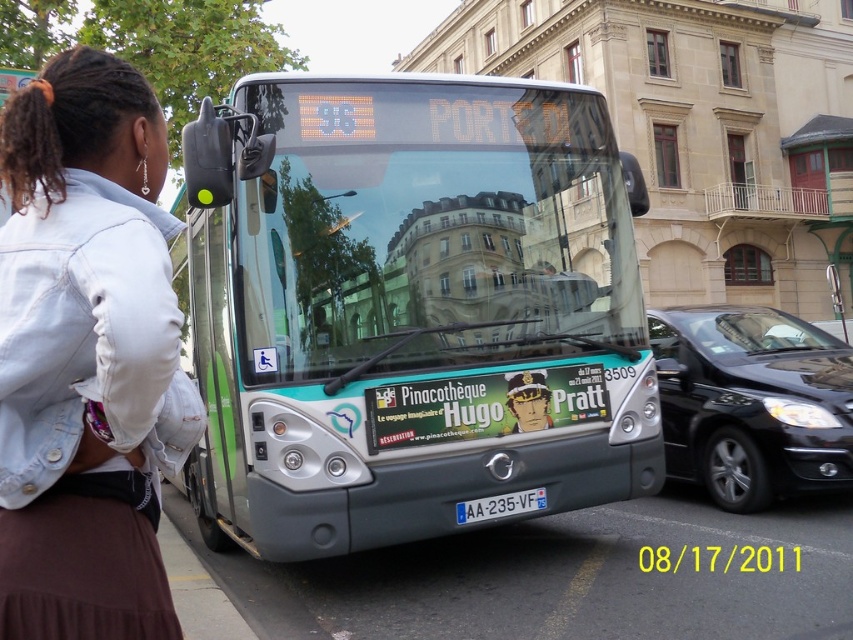
Question: Which of these objects is positioned farthest from the metallic silver bus at center?

Choices:
 (A) black glossy sedan at center
 (B) denim jacket at lower left
 (C) white plastic license plate at center

Answer: (A)

Question: Based on their relative distances, which object is nearer to the denim jacket at lower left?

Choices:
 (A) black glossy sedan at center
 (B) metallic silver bus at center
 (C) white plastic license plate at center

Answer: (B)

Question: Does denim jacket at lower left appear on the right side of black glossy sedan at center?

Choices:
 (A) yes
 (B) no

Answer: (B)

Question: Which of the following is the farthest from the observer?

Choices:
 (A) metallic silver bus at center
 (B) black glossy sedan at center
 (C) white plastic license plate at center
 (D) denim jacket at lower left

Answer: (B)

Question: Is metallic silver bus at center to the right of denim jacket at lower left from the viewer's perspective?

Choices:
 (A) yes
 (B) no

Answer: (A)

Question: Does denim jacket at lower left have a smaller size compared to white plastic license plate at center?

Choices:
 (A) no
 (B) yes

Answer: (A)